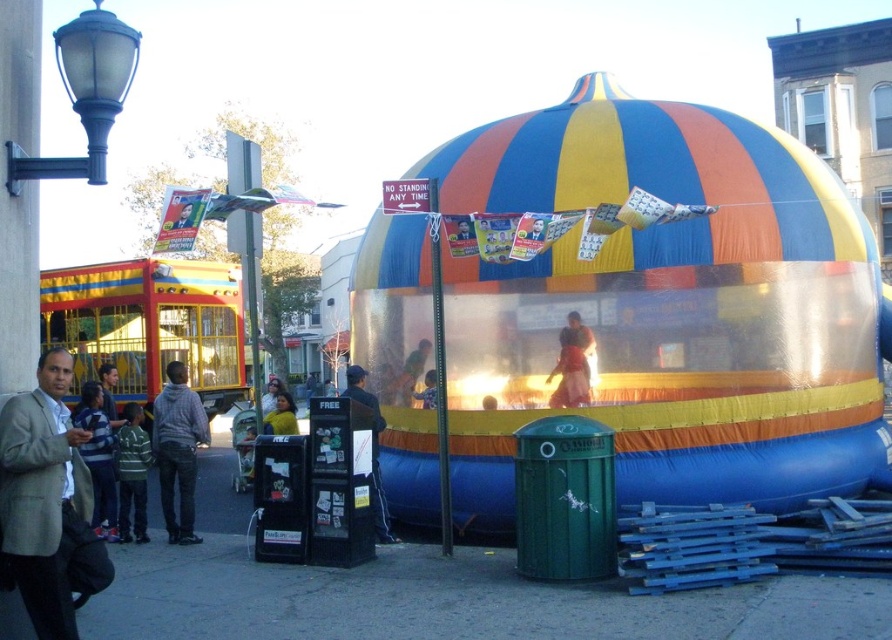
You are organizing an event and need to seat two people in the front row. The front row has seats that can only accommodate individuals of a certain size. Given that the light beige suit at lower left and the gray hoodie at left are present, which person should you seat in the front row if the seats are designed for smaller individuals?

The gray hoodie at left should be seated in the front row since the light beige suit at lower left has a larger size compared to gray hoodie at left, making the gray hoodie wearer more suitable for smaller seats.

You are standing at the point marked as point (x=178, y=412) in the image. The bouncy castle is in front of you. Can you see the green trash bin labeled Cambridge and the black newspaper vending machine from your current position?

The distance of point (x=178, y=412) from camera is 10.46 meters. Since the point is at 10.46 meters away from the camera, and the objects like the green trash bin labeled Cambridge and the black newspaper vending machine are in front of the bouncy castle, which is the main focus here, it is likely that these objects are positioned closer to the camera than the bouncy castle. Therefore, from your position at point (x=178, y=412), you should be able to see both the green trash bin labeled Cambridge and the black

You are standing at the point marked by the coordinates point (431, 593). You want to place a small potted plant on the ground here. Is the ground at this point suitable for placing the plant?

The ground at point (431, 593) is smooth concrete pavement, so yes, the ground is suitable for placing the small potted plant.